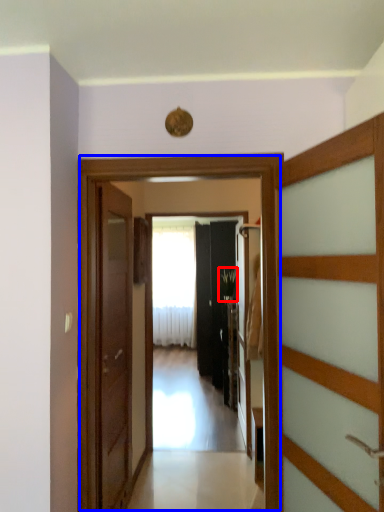
Question: Which object appears closest to the camera in this image, plant (highlighted by a red box) or elevator (highlighted by a blue box)?

Choices:
 (A) plant
 (B) elevator

Answer: (B)